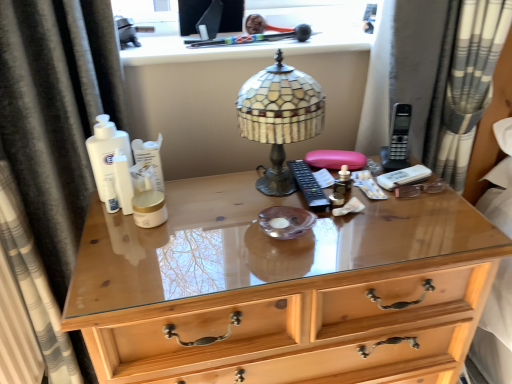
Question: Is black fabric curtain at left, which is counted as the 2th curtain, starting from the right, located outside wooden chest of drawers at center?

Choices:
 (A) yes
 (B) no

Answer: (A)

Question: From a real-world perspective, is black fabric curtain at left, which is counted as the 2th curtain, starting from the right, over wooden chest of drawers at center?

Choices:
 (A) yes
 (B) no

Answer: (A)

Question: Is black fabric curtain at left, which is counted as the 2th curtain, starting from the right, bigger than wooden chest of drawers at center?

Choices:
 (A) no
 (B) yes

Answer: (A)

Question: Is black fabric curtain at left, which is counted as the 2th curtain, starting from the right, far from wooden chest of drawers at center?

Choices:
 (A) yes
 (B) no

Answer: (B)

Question: From the image's perspective, is black fabric curtain at left, which appears as the first curtain when viewed from the left, located beneath wooden chest of drawers at center?

Choices:
 (A) no
 (B) yes

Answer: (A)

Question: Considering their positions, is black fabric curtain at left, which is counted as the 2th curtain, starting from the right, located in front of or behind wooden chest of drawers at center?

Choices:
 (A) front
 (B) behind

Answer: (A)

Question: Is point (104, 24) positioned closer to the camera than point (212, 226)?

Choices:
 (A) farther
 (B) closer

Answer: (A)

Question: From a real-world perspective, is black fabric curtain at left, which is counted as the 2th curtain, starting from the right, above or below wooden chest of drawers at center?

Choices:
 (A) below
 (B) above

Answer: (B)

Question: From the image's perspective, relative to wooden chest of drawers at center, is black fabric curtain at left, which is counted as the 2th curtain, starting from the right, above or below?

Choices:
 (A) below
 (B) above

Answer: (B)

Question: Looking at the image, does black fabric curtain at left, which is counted as the 2th curtain, starting from the right, seem bigger or smaller compared to gold matte jar at center, which ranks as the 1th toiletry in front-to-back order?

Choices:
 (A) big
 (B) small

Answer: (A)

Question: Based on their positions, is black fabric curtain at left, which appears as the first curtain when viewed from the left, located to the left or right of gold matte jar at center, which ranks as the 1th toiletry in front-to-back order?

Choices:
 (A) right
 (B) left

Answer: (B)

Question: Is black fabric curtain at left, which is counted as the 2th curtain, starting from the right, wider or thinner than gold matte jar at center, the 2th toiletry when ordered from top to bottom?

Choices:
 (A) wide
 (B) thin

Answer: (A)

Question: In terms of height, does black fabric curtain at left, which is counted as the 2th curtain, starting from the right, look taller or shorter compared to gold matte jar at center, which ranks as the 1th toiletry in front-to-back order?

Choices:
 (A) short
 (B) tall

Answer: (B)

Question: Is stained glass lampshade at center situated inside wooden chest of drawers at center or outside?

Choices:
 (A) outside
 (B) inside

Answer: (A)

Question: From a real-world perspective, relative to wooden chest of drawers at center, is stained glass lampshade at center vertically above or below?

Choices:
 (A) below
 (B) above

Answer: (B)